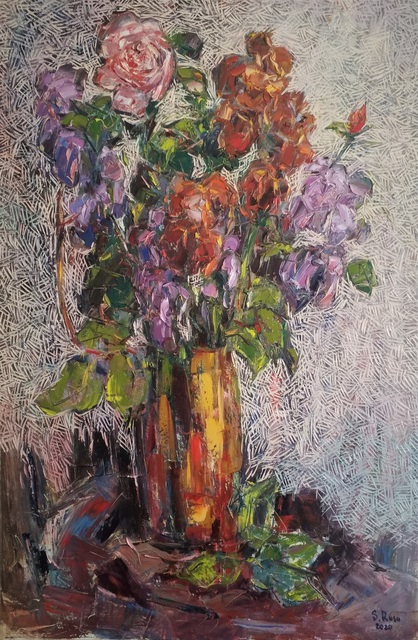
This screenshot has height=640, width=418. I want to click on surface vase is sitting on, so click(x=264, y=617).